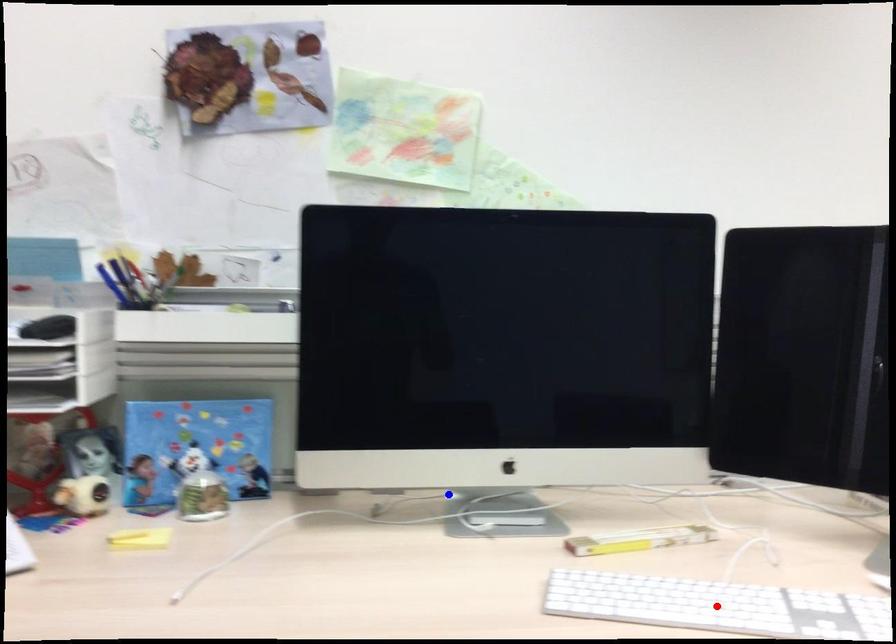
Question: In the image, two points are highlighted. Which point is nearer to the camera? Reply with the corresponding letter.

Choices:
 (A) blue point
 (B) red point

Answer: (B)